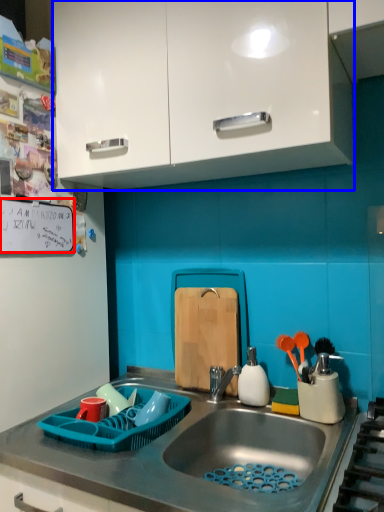
Question: Which object is closer to the camera taking this photo, bulletin board (highlighted by a red box) or cabinetry (highlighted by a blue box)?

Choices:
 (A) bulletin board
 (B) cabinetry

Answer: (B)